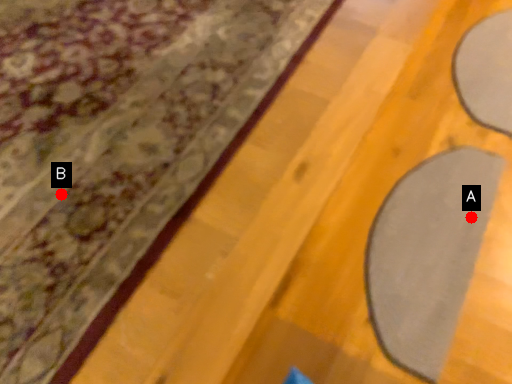
Question: Two points are circled on the image, labeled by A and B beside each circle. Which of the following is the farthest from the observer?

Choices:
 (A) A is further
 (B) B is further

Answer: (A)